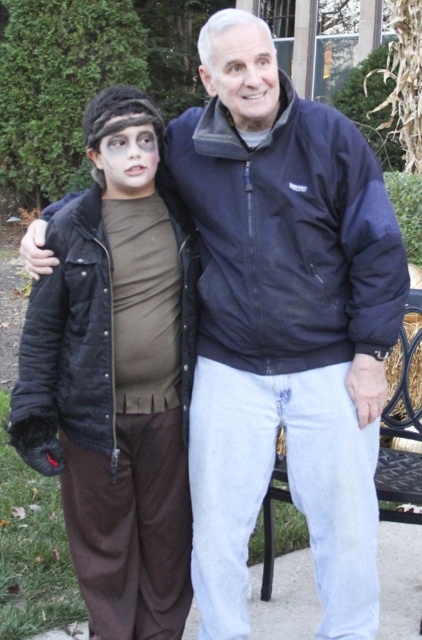
You are a photographer adjusting your camera settings to focus on the matte black jacket at left and the metallic black bench at lower right. Since both are black, you want to ensure the focus is sharp. Which object should you adjust the focus on first to ensure it appears clearer in the photo?

You should focus on the matte black jacket at left first because it is closer to the viewer than the metallic black bench at lower right, so adjusting focus starting from the closer object ensures proper depth of field.